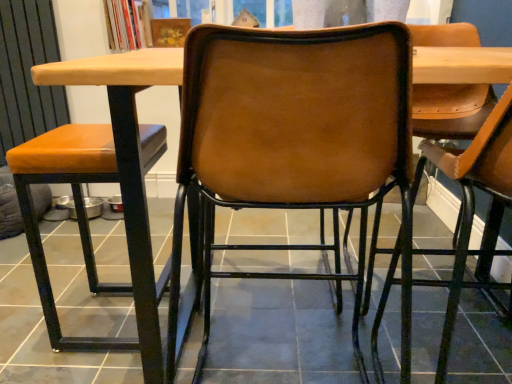
Find the location of a particular element. The height and width of the screenshot is (384, 512). free region on the left part of orange leather stool at left, the 3th chair viewed from the right is located at coordinates (32, 326).